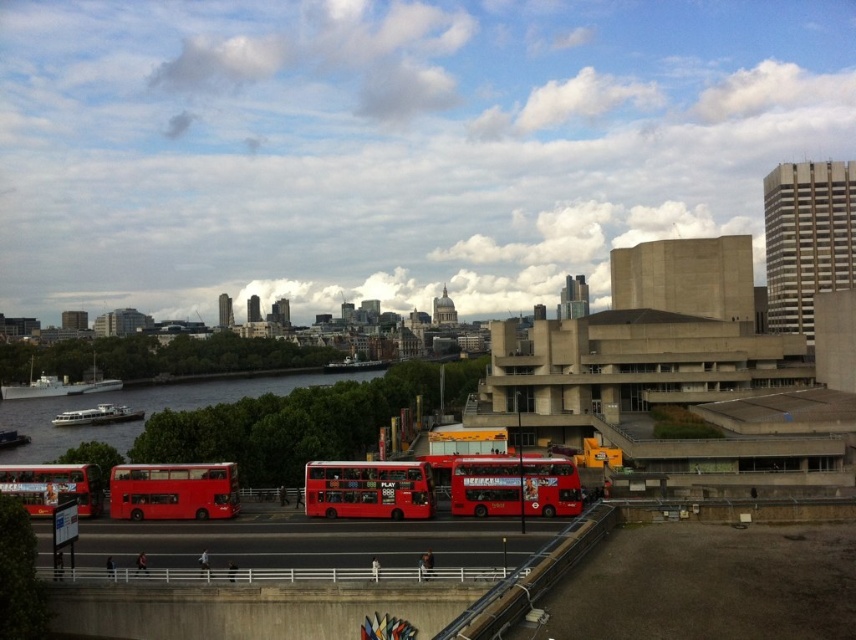
Question: Which point is farther to the camera?

Choices:
 (A) (496, 483)
 (B) (316, 493)

Answer: (A)

Question: Can you confirm if matte red double-decker bus at center is bigger than matte red double-decker bus at lower left?

Choices:
 (A) no
 (B) yes

Answer: (B)

Question: Which object is the farthest from the matte red double-decker bus at lower left?

Choices:
 (A) red matte double-decker bus at center
 (B) matte red bus at center

Answer: (A)

Question: Among these points, which one is farthest from the camera?

Choices:
 (A) (355, 486)
 (B) (135, 490)

Answer: (B)

Question: Does matte red double-decker bus at center come in front of matte red bus at center?

Choices:
 (A) yes
 (B) no

Answer: (A)

Question: Considering the relative positions of matte red bus at center and matte red double-decker bus at lower left in the image provided, where is matte red bus at center located with respect to matte red double-decker bus at lower left?

Choices:
 (A) left
 (B) right

Answer: (B)